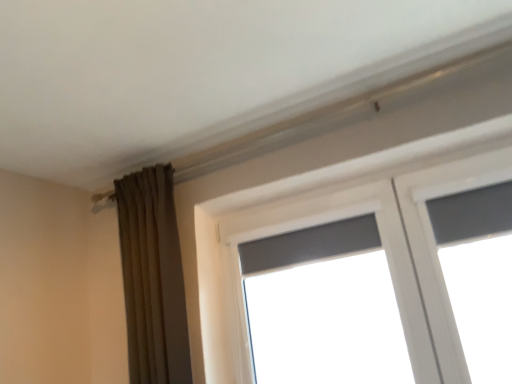
Question: Considering the positions of point (155, 246) and point (322, 296), is point (155, 246) closer or farther from the camera than point (322, 296)?

Choices:
 (A) farther
 (B) closer

Answer: (B)

Question: In terms of height, does brown fabric curtain at left look taller or shorter compared to matte gray window at center?

Choices:
 (A) short
 (B) tall

Answer: (B)

Question: In terms of width, does brown fabric curtain at left look wider or thinner when compared to matte gray window at center?

Choices:
 (A) thin
 (B) wide

Answer: (B)

Question: From a real-world perspective, relative to brown fabric curtain at left, is matte gray window at center vertically above or below?

Choices:
 (A) below
 (B) above

Answer: (A)

Question: Would you say matte gray window at center is to the left or to the right of brown fabric curtain at left in the picture?

Choices:
 (A) left
 (B) right

Answer: (B)

Question: From the image's perspective, is matte gray window at center located above or below brown fabric curtain at left?

Choices:
 (A) above
 (B) below

Answer: (B)

Question: In terms of width, does matte gray window at center look wider or thinner when compared to brown fabric curtain at left?

Choices:
 (A) wide
 (B) thin

Answer: (B)